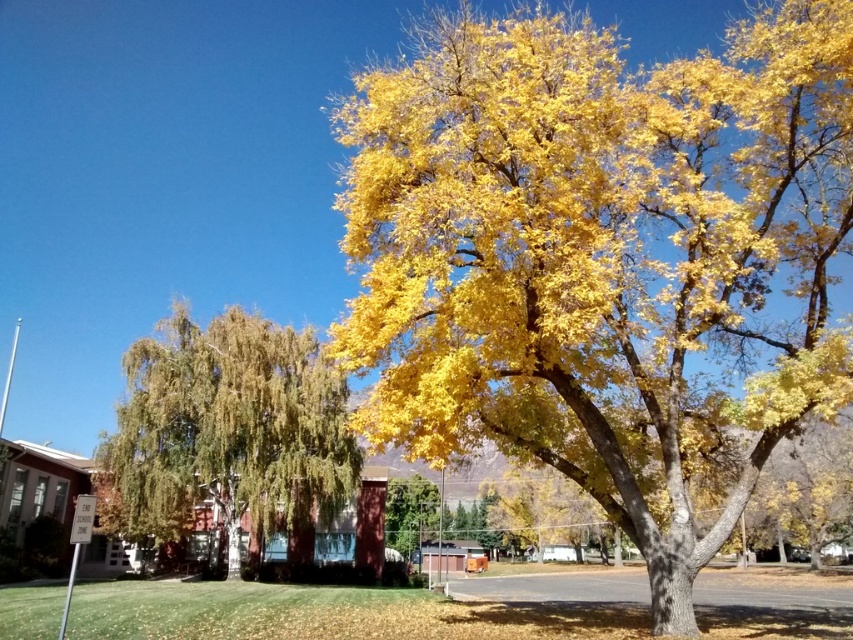
Question: Which point is closer to the camera?

Choices:
 (A) green leafy tree at left
 (B) golden leafy tree at center

Answer: (B)

Question: Where is golden leafy tree at center located in relation to green leafy tree at left in the image?

Choices:
 (A) left
 (B) right

Answer: (B)

Question: Which point is closer to the camera?

Choices:
 (A) (120, 436)
 (B) (527, 164)

Answer: (B)

Question: In this image, where is golden leafy tree at center located relative to green leafy tree at left?

Choices:
 (A) left
 (B) right

Answer: (B)

Question: Does golden leafy tree at center lie behind green leafy tree at left?

Choices:
 (A) no
 (B) yes

Answer: (A)